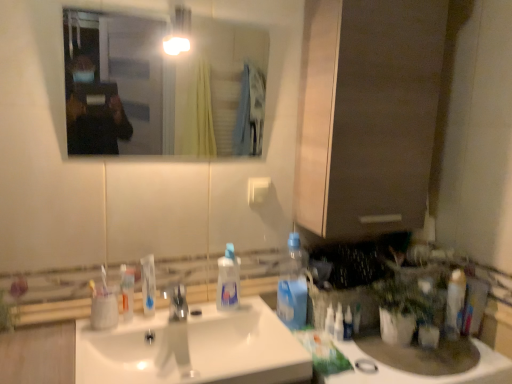
Find the location of `free location in front of white glossy toothpaste tube at right, placed as the first toiletry when sorted from right to left`. free location in front of white glossy toothpaste tube at right, placed as the first toiletry when sorted from right to left is located at coordinates (466, 361).